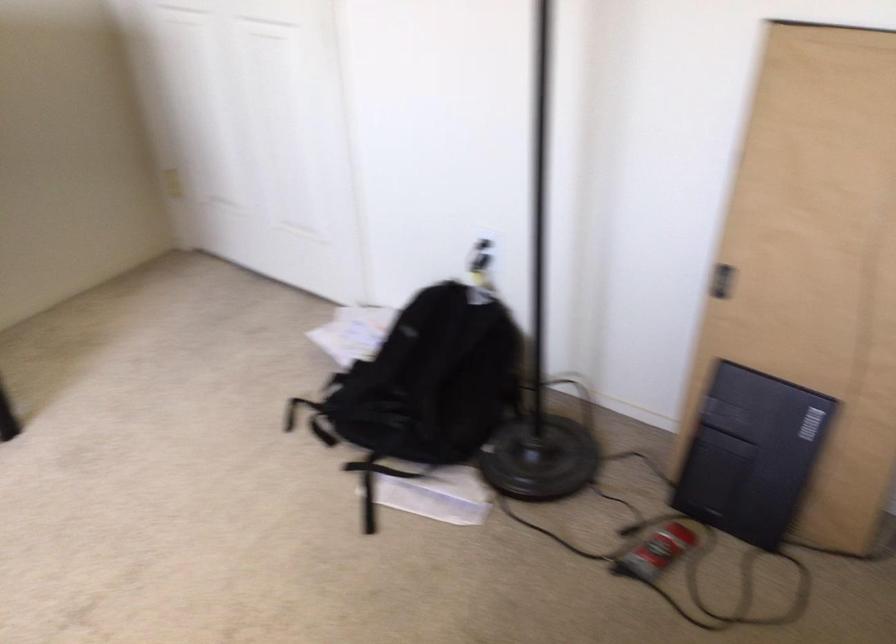
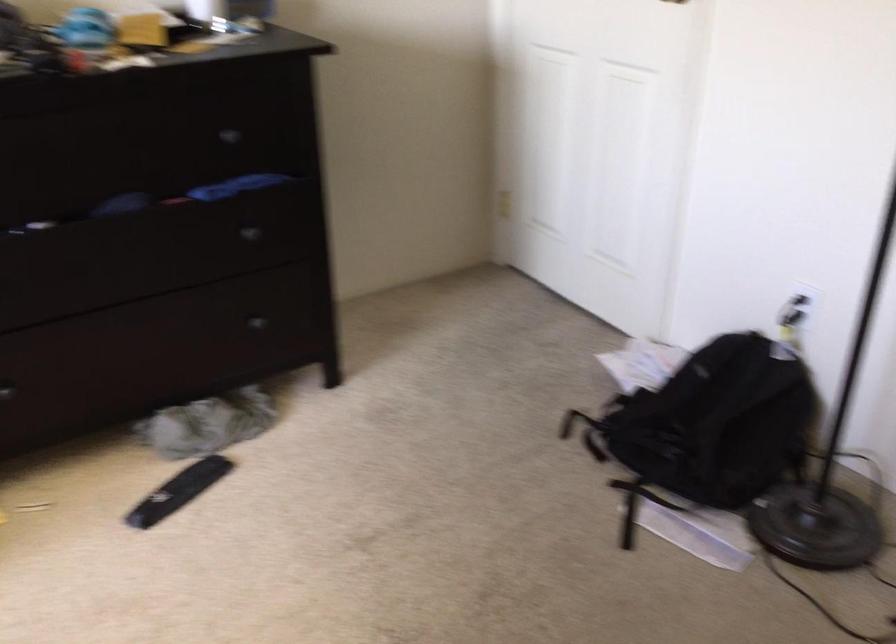
The images are taken continuously from a first-person perspective. In which direction are you moving?

The cameraman walked toward left, backward.